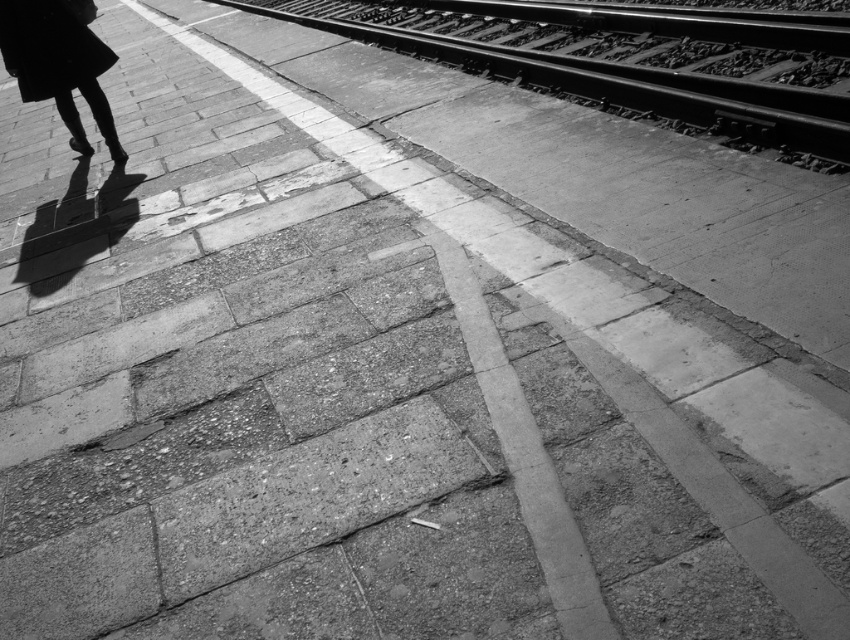
Does smooth metal train track at upper right appear under silhouette dress at left?

No.

Between point (468, 17) and point (1, 49), which one is positioned in front?

Point (1, 49)

The height and width of the screenshot is (640, 850). In order to click on smooth metal train track at upper right in this screenshot , I will do `click(608, 67)`.